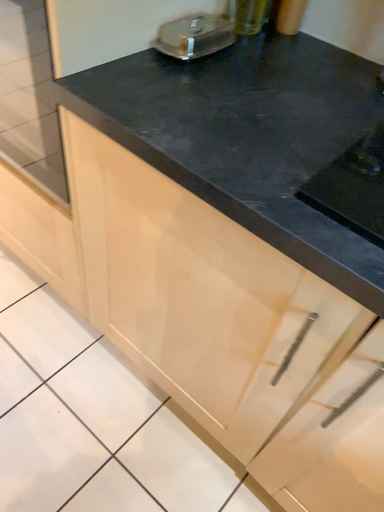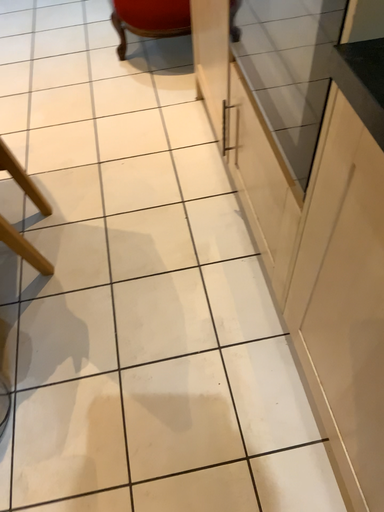
Question: Which way did the camera rotate in the video?

Choices:
 (A) rotated left
 (B) rotated right

Answer: (A)